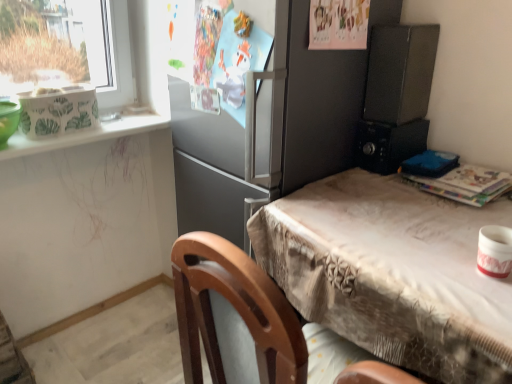
This screenshot has height=384, width=512. Identify the location of free location in front of white glossy mug at upper right, the 1th appliance in the bottom-to-top sequence. tap(489, 308).